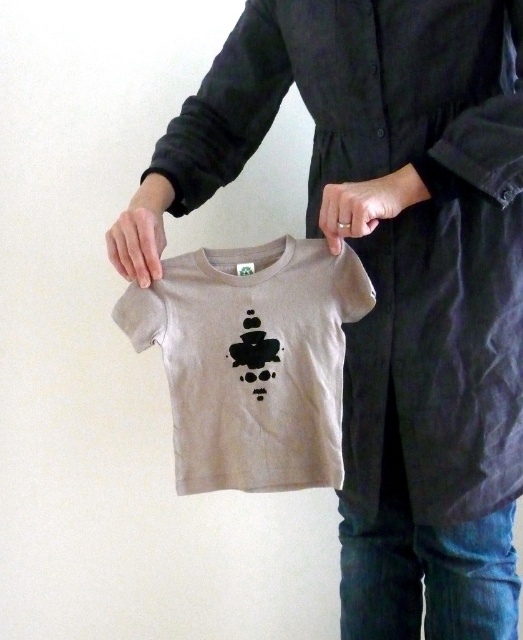
Can you confirm if light beige cotton t-shirt at center is wider than smooth beige hand at center?

Yes.

Between light beige cotton t-shirt at center and smooth beige hand at center, which one has more height?

light beige cotton t-shirt at center is taller.

At what (x,y) coordinates should I click in order to perform the action: click on light beige cotton t-shirt at center. Please return your answer as a coordinate pair (x, y). The image size is (523, 640). Looking at the image, I should click on (253, 360).

Who is positioned more to the left, matte black hand at center or smooth beige hand at center?

smooth beige hand at center

Between matte black hand at center and smooth beige hand at center, which one is positioned lower?

Positioned lower is smooth beige hand at center.

Identify the location of matte black hand at center. [x=363, y=205].

Where is `matte black hand at center`? The width and height of the screenshot is (523, 640). matte black hand at center is located at coordinates (363, 205).

Does light beige cotton t-shirt at center have a smaller size compared to matte black hand at center?

Incorrect, light beige cotton t-shirt at center is not smaller in size than matte black hand at center.

Does point (237, 374) lie in front of point (329, 182)?

That is True.

Locate an element on the screen. The height and width of the screenshot is (640, 523). light beige cotton t-shirt at center is located at coordinates (253, 360).